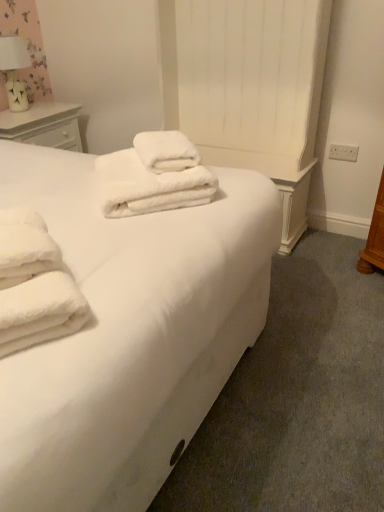
Where is `free location to the right of white ceramic table lamp at upper left`? free location to the right of white ceramic table lamp at upper left is located at coordinates (55, 109).